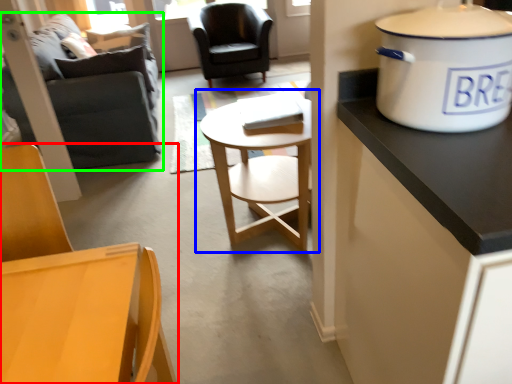
Question: Which object is positioned closest to chair (highlighted by a red box)? Select from coffee table (highlighted by a blue box) and studio couch (highlighted by a green box).

Choices:
 (A) coffee table
 (B) studio couch

Answer: (A)